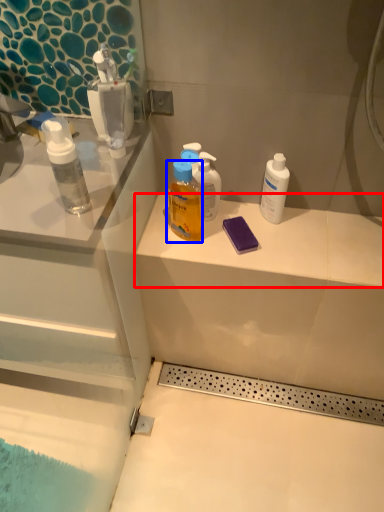
Question: Which point is closer to the camera, counter top (highlighted by a red box) or bottle (highlighted by a blue box)?

Choices:
 (A) counter top
 (B) bottle

Answer: (B)